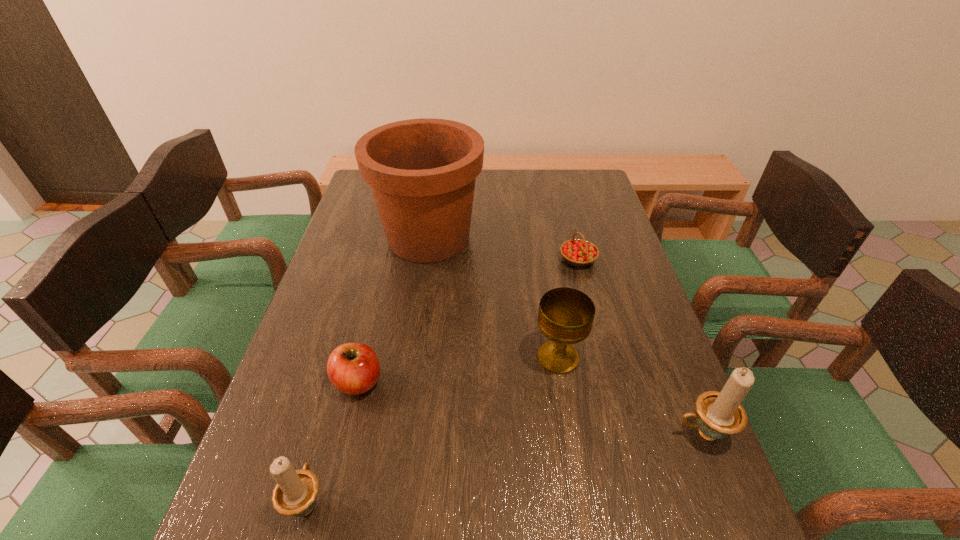
At what (x,y) coordinates should I click in order to perform the action: click on free area in between the chalice and the second shortest object. Please return your answer as a coordinate pair (x, y). Looking at the image, I should click on (458, 370).

You are a GUI agent. You are given a task and a screenshot of the screen. Output one action in this format:
    pyautogui.click(x=<x>, y=<y>)
    Task: Click on the free space between the strawberry and the left candle_holder
    This screenshot has width=960, height=540.
    Given the screenshot: What is the action you would take?
    pyautogui.click(x=443, y=381)

The width and height of the screenshot is (960, 540). What are the coordinates of `vacant space in between the chalice and the fifth tallest object` in the screenshot? It's located at (458, 370).

This screenshot has height=540, width=960. I want to click on vacant space that's between the left candle_holder and the right candle_holder, so click(505, 468).

Locate an element on the screen. Image resolution: width=960 pixels, height=540 pixels. vacant space that's between the taller candle_holder and the strawberry is located at coordinates (640, 346).

Where is `vacant area between the nearer candle_holder and the shortest object`? Image resolution: width=960 pixels, height=540 pixels. vacant area between the nearer candle_holder and the shortest object is located at coordinates (443, 381).

Locate an element on the screen. The image size is (960, 540). unoccupied area between the nearest object and the right candle_holder is located at coordinates (505, 468).

Choose which object is the nearest neighbor to the second tallest object. Please provide its 2D coordinates. Your answer should be formatted as a tuple, i.e. [(x, y)], where the tuple contains the x and y coordinates of a point satisfying the conditions above.

[(566, 315)]

Where is `object that is the fifth closest to the strawberry`? The height and width of the screenshot is (540, 960). object that is the fifth closest to the strawberry is located at coordinates (295, 494).

Identify the location of vacant region that satisfies the following two spatial constraints: 1. on the handle side of the nearest object; 2. on the right side of the flowerpot. Image resolution: width=960 pixels, height=540 pixels. (380, 238).